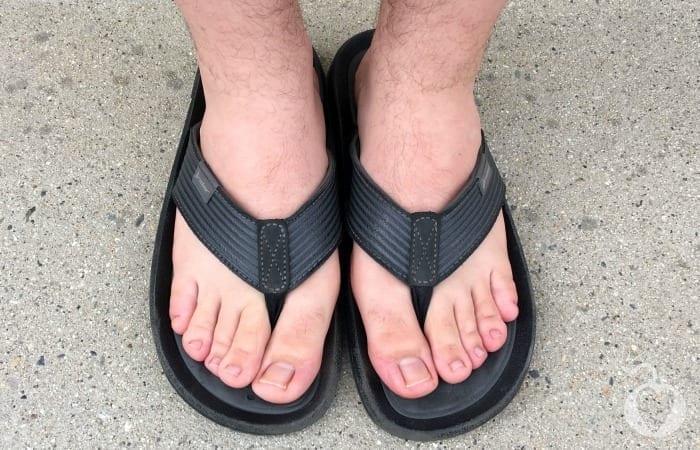
Find the location of `concrete floor`. concrete floor is located at coordinates (659, 307).